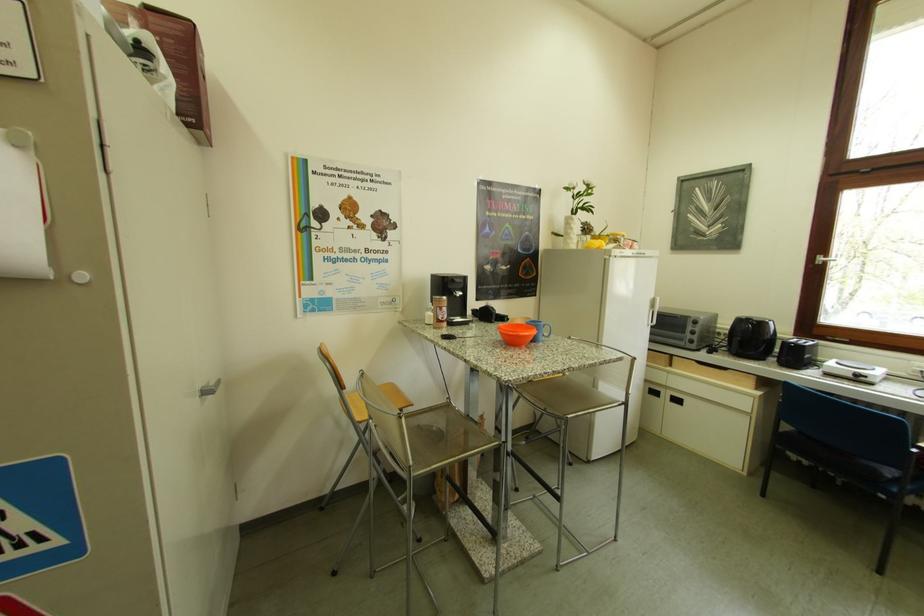
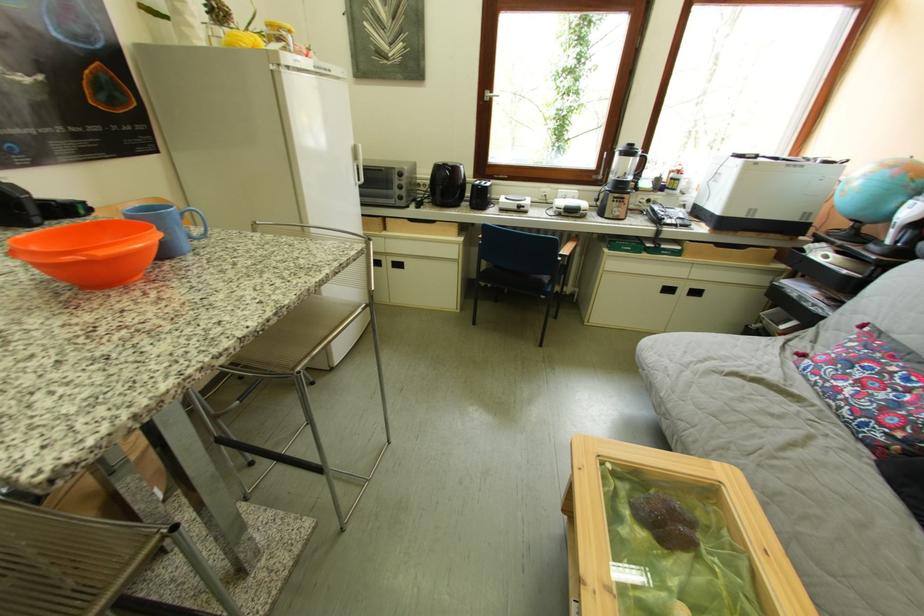
Where in the second image is the point corresponding to point (553, 325) from the first image?

(183, 209)